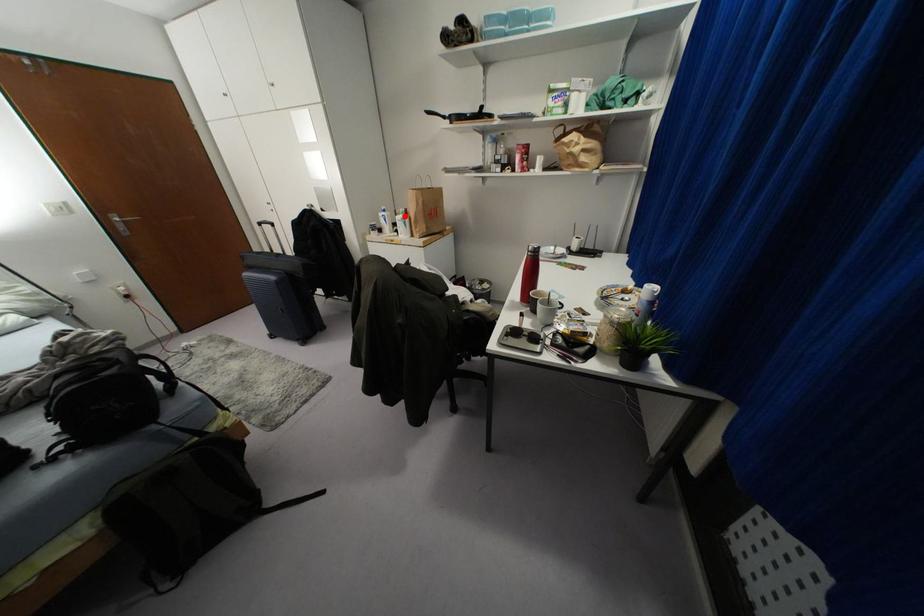
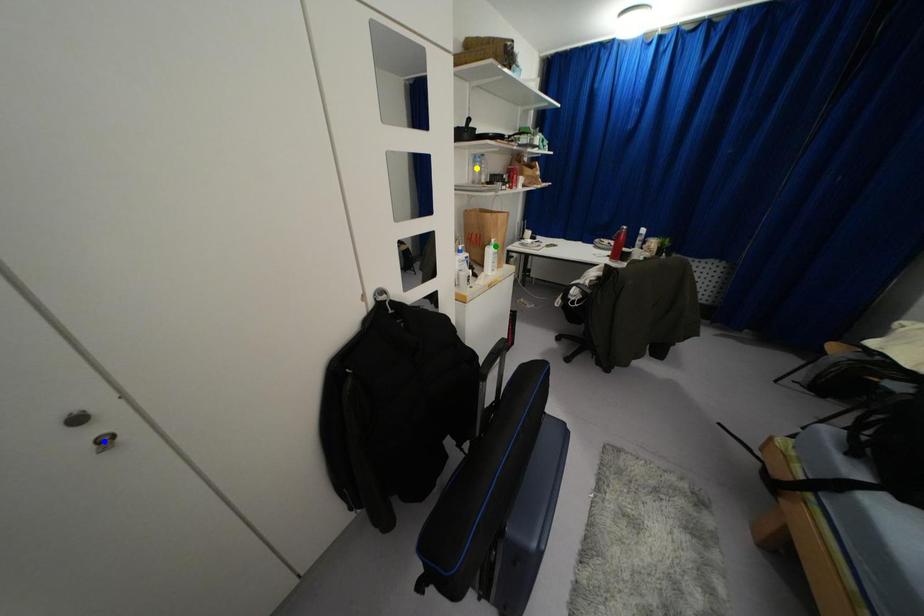
Question: I am providing you with two images of the same scene from different viewpoints. A red point is marked on the first image. You are given multiple points on the second image. Which point in image 2 is actually the same real-world point as the red point in image 1?

Choices:
 (A) yellow point
 (B) blue point
 (C) green point

Answer: (C)